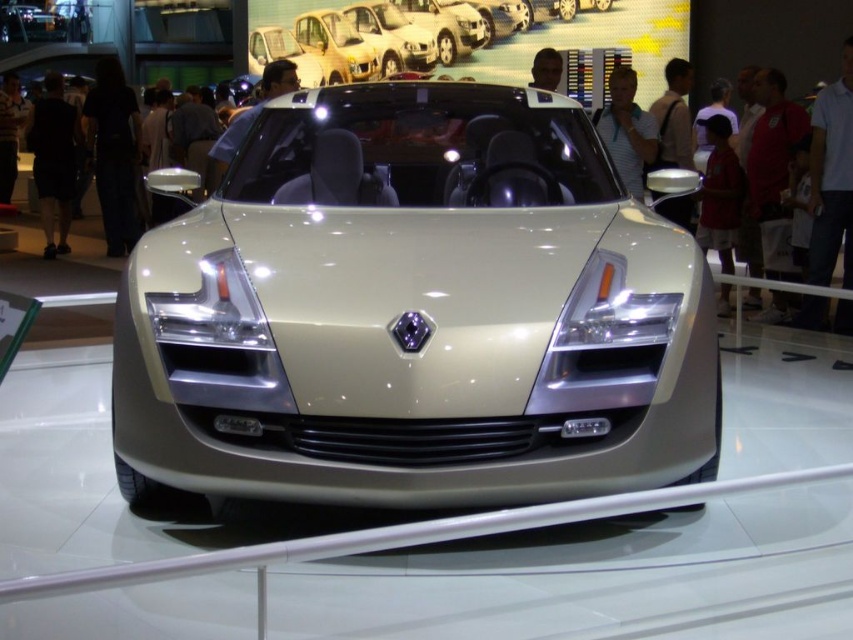
Question: Among these points, which one is farthest from the camera?

Choices:
 (A) click(274, 20)
 (B) click(582, 452)

Answer: (A)

Question: Does metallic silver car at center appear over satin silver car at upper center?

Choices:
 (A) yes
 (B) no

Answer: (B)

Question: Is metallic silver car at center in front of satin silver car at upper center?

Choices:
 (A) no
 (B) yes

Answer: (B)

Question: Is metallic silver car at center positioned at the back of satin silver car at upper center?

Choices:
 (A) yes
 (B) no

Answer: (B)